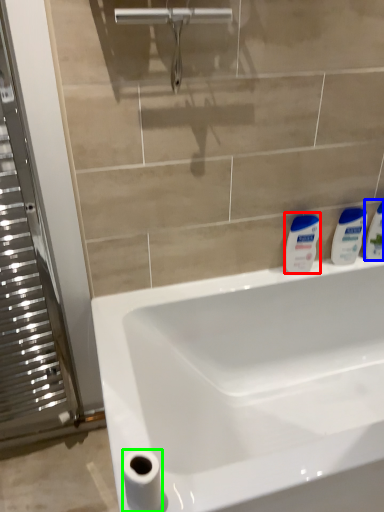
Question: Based on their relative distances, which object is farther from cleaning product (highlighted by a red box)? Choose from toiletry (highlighted by a blue box) and toilet paper (highlighted by a green box).

Choices:
 (A) toiletry
 (B) toilet paper

Answer: (B)